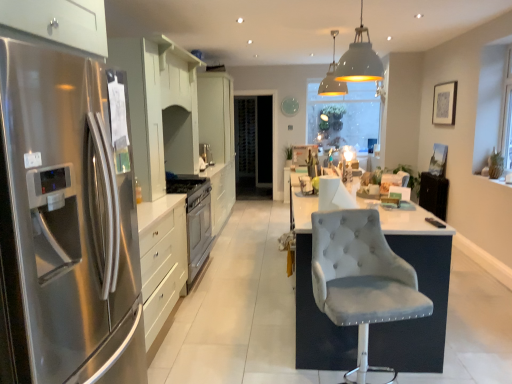
Question: In terms of height, does stainless steel refrigerator at left look taller or shorter compared to white glossy cabinets at center?

Choices:
 (A) short
 (B) tall

Answer: (A)

Question: Is point (118, 215) closer or farther from the camera than point (222, 188)?

Choices:
 (A) closer
 (B) farther

Answer: (A)

Question: Which is nearer to the velvet grey chair at center?

Choices:
 (A) transparent glass window screen at center
 (B) white glossy cabinets at center
 (C) satin silver oven at center
 (D) matte white pendant lamp at upper center, the 1th light fixture when ordered from back to front
 (E) white matte pendant lamp at upper center, marked as the 2th light fixture in a back-to-front arrangement

Answer: (E)

Question: Which object is positioned farthest from the stainless steel refrigerator at left?

Choices:
 (A) transparent glass window screen at center
 (B) transparent glass door at center
 (C) velvet grey chair at center
 (D) white matte pendant lamp at upper center, the first light fixture positioned from the front
 (E) matte white pendant lamp at upper center, the 1th light fixture when ordered from back to front

Answer: (B)